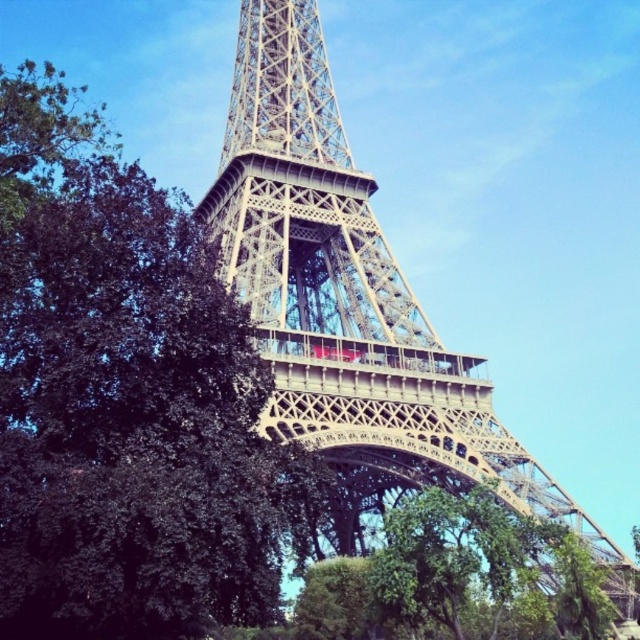
Question: Can you confirm if green leafy tree at center-left is positioned to the left of metallic structure at center?

Choices:
 (A) no
 (B) yes

Answer: (B)

Question: Observing the image, what is the correct spatial positioning of metallic structure at center in reference to green leafy tree at lower center?

Choices:
 (A) below
 (B) above

Answer: (B)

Question: Which object is the farthest from the metallic structure at center?

Choices:
 (A) green leafy tree at center-left
 (B) green leafy tree at lower center

Answer: (A)

Question: Can you confirm if metallic structure at center is positioned to the left of green leafy tree at lower center?

Choices:
 (A) yes
 (B) no

Answer: (A)

Question: Which object is the closest to the green leafy tree at lower center?

Choices:
 (A) green leafy tree at center-left
 (B) metallic structure at center

Answer: (B)

Question: Estimate the real-world distances between objects in this image. Which object is closer to the green leafy tree at center-left?

Choices:
 (A) green leafy tree at lower center
 (B) metallic structure at center

Answer: (B)